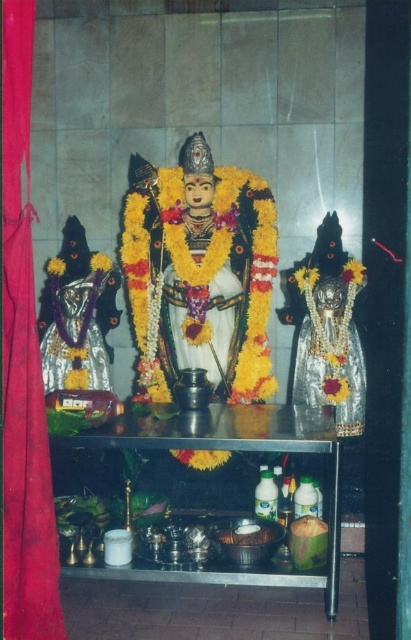
You are standing in front of the shrine and want to place a bouquet of flowers on the metallic table at center. If your arm can reach 3 meters, can you place the bouquet without moving closer?

The metallic table at center is 9.40 feet away from camera. Since 9.40 feet is approximately 2.87 meters, which is within your arm reach of 3 meters, you can place the bouquet without moving closer.

You are a temple visitor who wants to place a small offering on the shrine. The offering requires placing it between the white glossy statue at center and the white matte coconut at center. Is there enough space to place your offering between them?

The white glossy statue at center and the white matte coconut at center are 1.29 meters apart from each other, so yes, there is enough space to place your offering between them since the distance is sufficient.